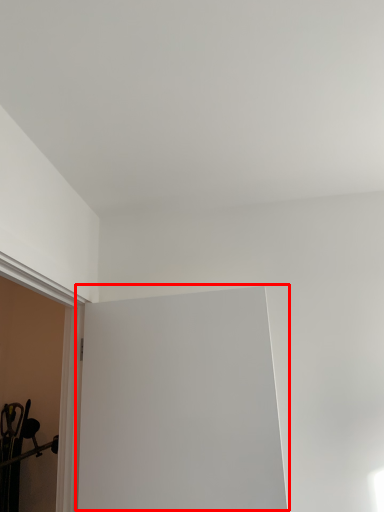
Question: In this image, where is window screen (annotated by the red box) located relative to window sill?

Choices:
 (A) left
 (B) right

Answer: (B)